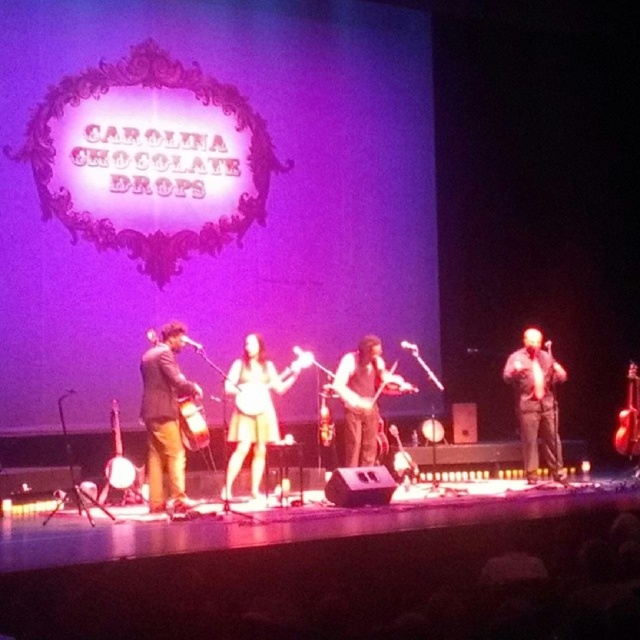
Based on the photo, you are a stagehand setting up microphones for the Carolina Chocolate Drops. You need to place a microphone stand between the yellow fabric banjo at center and the metallic gold banjo at center. Considering their sizes, which banjo should the taller microphone stand be placed near?

The yellow fabric banjo at center is larger in size compared to the metallic gold banjo at center, so the taller microphone stand should be placed near the yellow fabric banjo at center to accommodate its size.

You are a photographer at the back of the venue and want to capture both the yellow fabric banjo at center and the matte brown suit at center in a single shot. Considering their sizes, which object will appear larger in your photo?

The yellow fabric banjo at center will appear larger in the photo because it has a larger size compared to the matte brown suit at center.

You are a photographer positioned at the center of the stage. You want to take a photo that includes both the point at coordinates point (259, 392) and point (323, 413). Which point should you focus on first to ensure both are in frame?

Point (259, 392) is in front of point (323, 413), so you should focus on point (259, 392) first to ensure both are in frame.